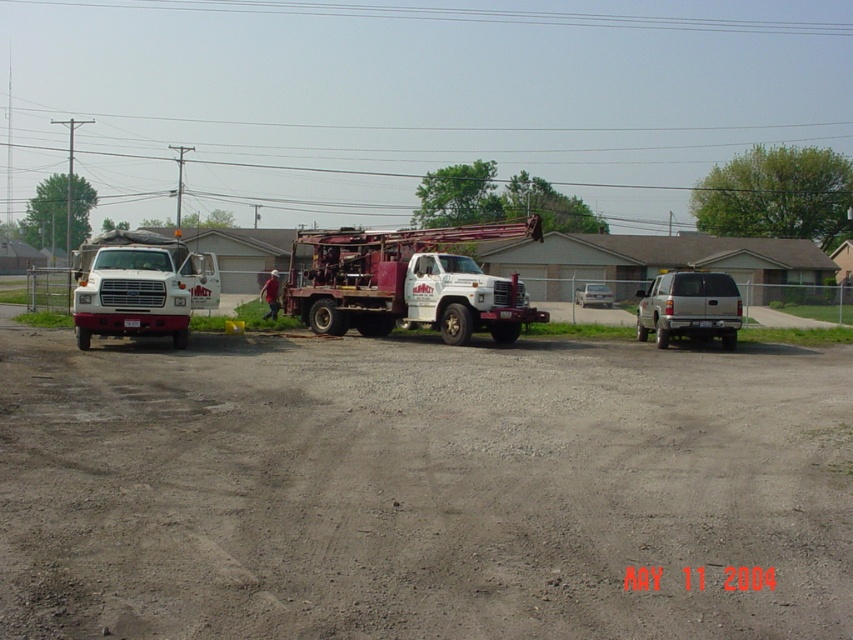
You are standing at the point marked by the coordinates (419, 488) in the image. What is the terrain type under your feet?

The terrain type under your feet is gray gravel dirt track at center.

You are standing at the point labeled point (152,6) and want to walk to the point labeled point (97,316). Which direction should you face to walk directly towards your destination?

You should face north to walk directly towards point 0.495, 0.179 from point (152,6).

You are standing at the edge of the lot and want to walk to the white painted metal drill truck at center. Is the gray gravel dirt track at center between you and the truck?

Yes, the gray gravel dirt track at center is between you and the white painted metal drill truck at center because the gray gravel dirt track at center is closer to the viewer than the white painted metal drill truck at center.